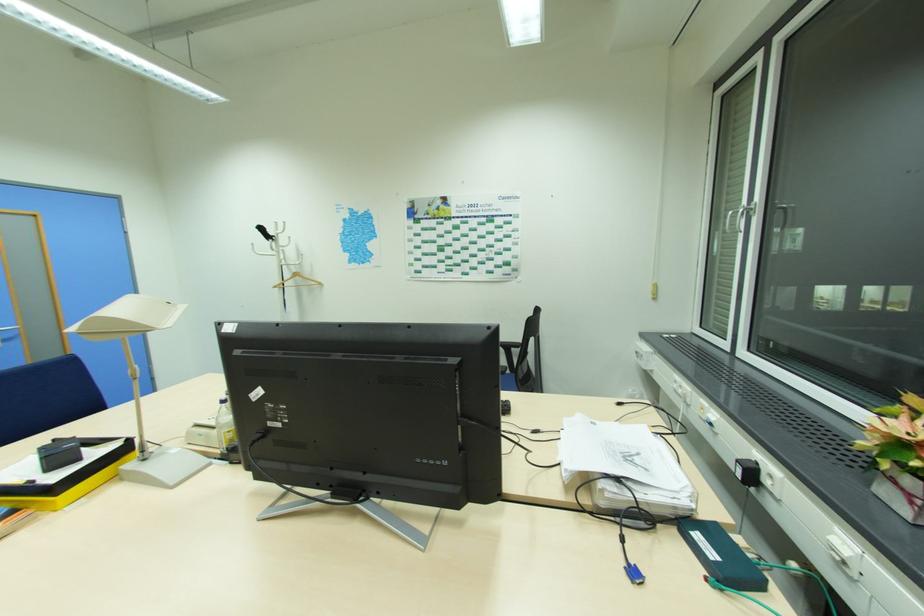
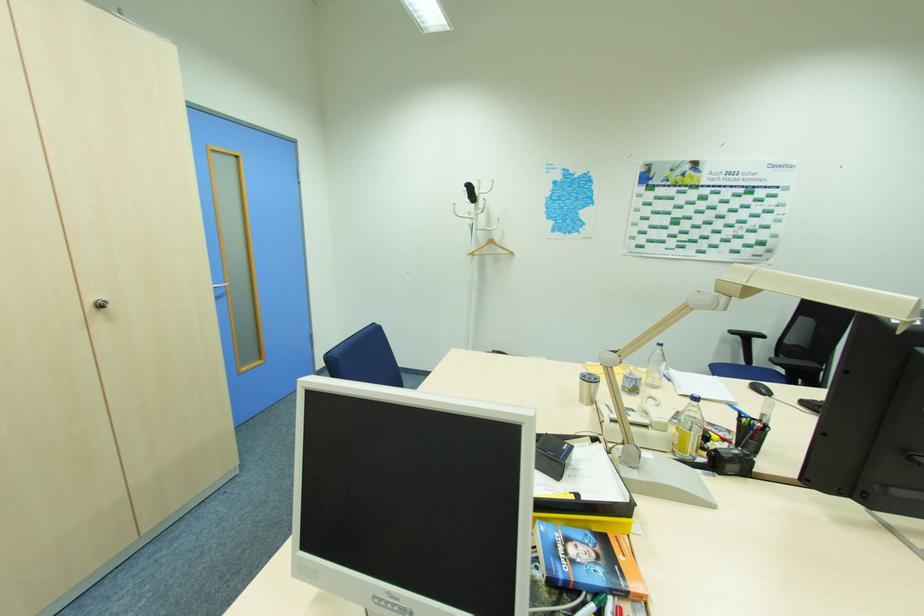
Question: Which direction would the cameraman need to move to produce the second image? Reply with the corresponding letter.

Choices:
 (A) Left
 (B) Right
 (C) Forward
 (D) Backward

Answer: (A)